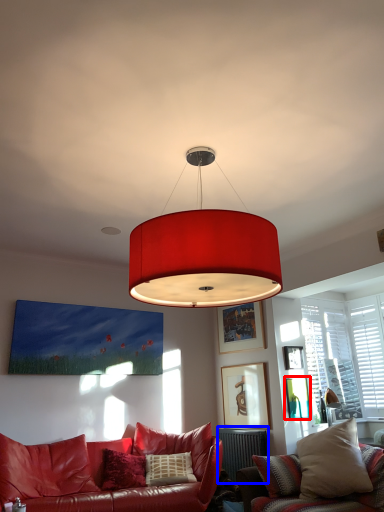
Question: Which point is further to the camera, picture frame (highlighted by a red box) or radiator (highlighted by a blue box)?

Choices:
 (A) picture frame
 (B) radiator

Answer: (A)